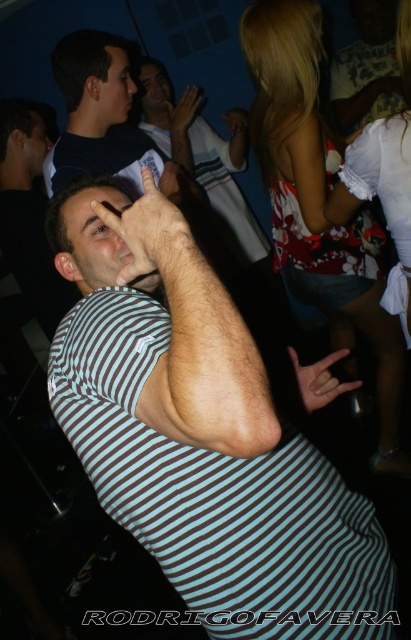
You are a photographer at the party and want to capture both the white matte hand at center and the matte skin hand at center in a single frame. Which hand should you focus on first to ensure both are in the frame?

The white matte hand at center has a lesser height compared to matte skin hand at center, so you should focus on the taller matte skin hand at center first to ensure both are in the frame.

Consider the image. You are organizing a clothing display and need to place the matte black shirt at upper left and the striped fabric shirt at center side by side. Which shirt should be placed on the left side to ensure they fit within the display area?

The matte black shirt at upper left has a lesser width compared to the striped fabric shirt at center, so placing the narrower matte black shirt at upper left on the left side would allow the wider striped fabric shirt at center to fit better on the right side of the display area.

You are a photographer at the party and want to capture a photo of the smooth skin face at center without the floral fabric dress at upper right appearing in the frame. Based on their distance, can you position yourself to do this?

The floral fabric dress at upper right is 1.17 meters away from smooth skin face at center. By positioning yourself closer to the smooth skin face at center and angling the camera away from the floral fabric dress at upper right, you can ensure the dress does not appear in the frame.